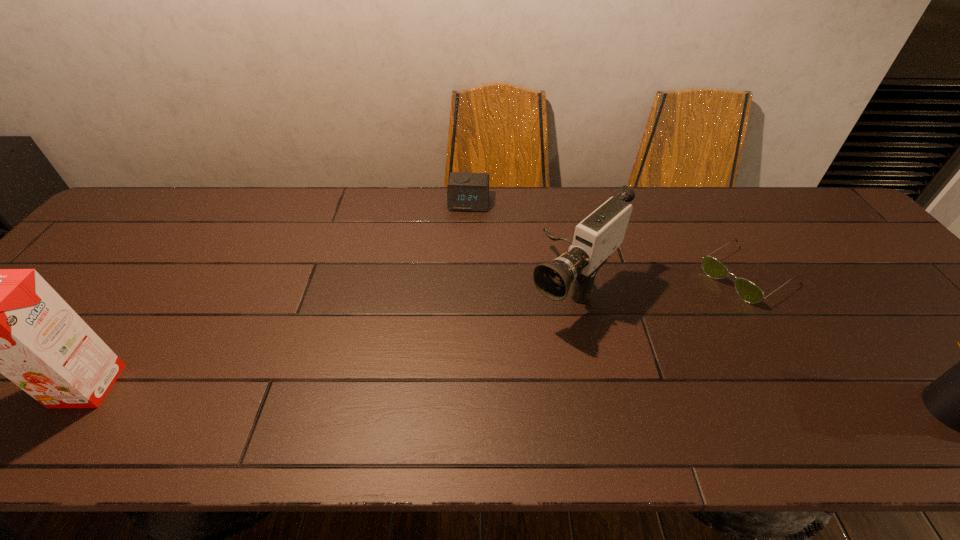
At what (x,y) coordinates should I click in order to perform the action: click on the tallest object. Please return your answer as a coordinate pair (x, y). The width and height of the screenshot is (960, 540). Looking at the image, I should click on (11, 321).

The width and height of the screenshot is (960, 540). I want to click on carton, so click(x=11, y=321).

Where is `the second object from right to left`? The width and height of the screenshot is (960, 540). the second object from right to left is located at coordinates (749, 292).

Where is `the shortest object`? The image size is (960, 540). the shortest object is located at coordinates (749, 292).

Image resolution: width=960 pixels, height=540 pixels. Find the location of `the third object from left to right`. the third object from left to right is located at coordinates (596, 237).

In order to click on the second tallest object in this screenshot , I will do `click(596, 237)`.

Where is `alarm clock`? alarm clock is located at coordinates (465, 191).

Locate an element on the screen. The width and height of the screenshot is (960, 540). the second object from left to right is located at coordinates (465, 191).

Where is `vacant point located 0.170m on the back of the leftmost object`? The image size is (960, 540). vacant point located 0.170m on the back of the leftmost object is located at coordinates (144, 307).

Find the location of a particular element. This screenshot has height=540, width=960. vacant space located 0.400m on the front-facing side of the shortest object is located at coordinates (604, 368).